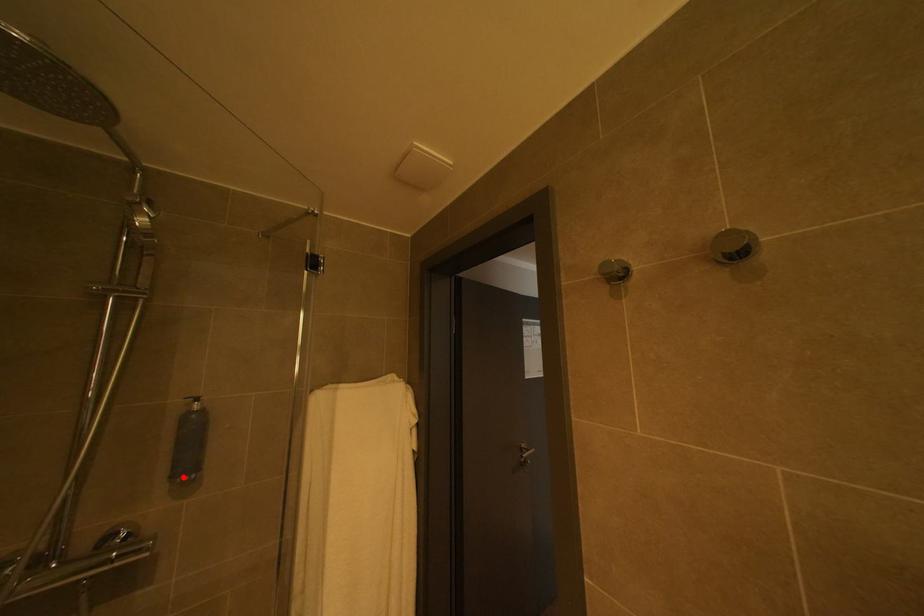
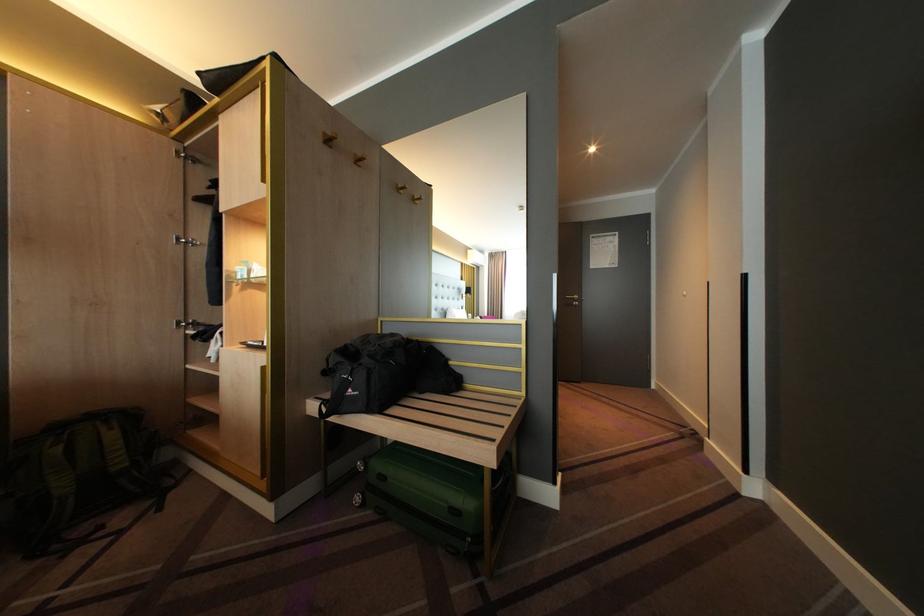
Question: I am providing you with two images of the same scene from different viewpoints. A red point is marked on the first image. At the location where the point appears in image 1, is it still visible in image 2?

Choices:
 (A) Yes
 (B) No

Answer: (B)